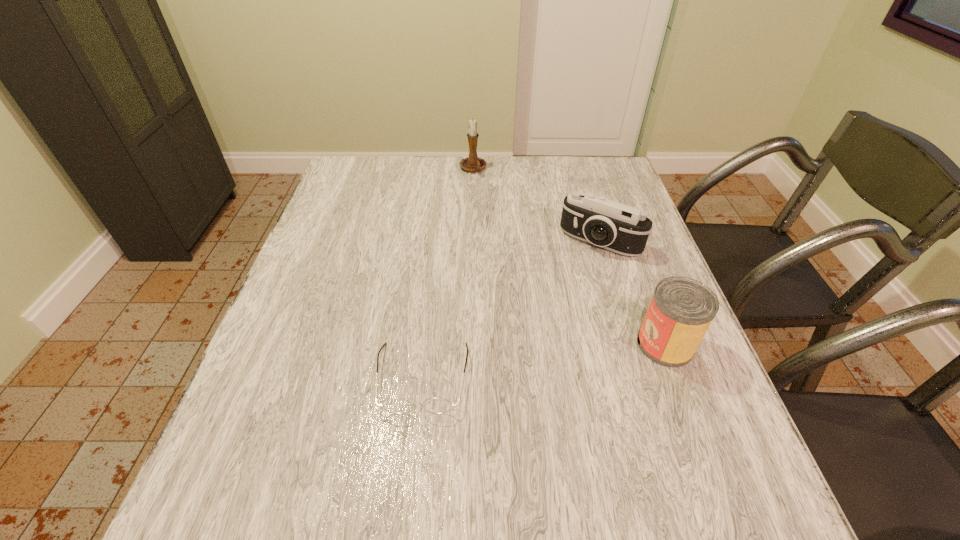
In order to click on free region at the far left corner of the desktop in this screenshot , I will do `click(354, 195)`.

Image resolution: width=960 pixels, height=540 pixels. I want to click on free location at the near right corner, so click(x=650, y=428).

In order to click on vacant point located between the spectacles and the farthest object in this screenshot , I will do `click(447, 273)`.

At what (x,y) coordinates should I click in order to perform the action: click on blank region between the shortest object and the candle holder. Please return your answer as a coordinate pair (x, y). The height and width of the screenshot is (540, 960). Looking at the image, I should click on (447, 273).

Image resolution: width=960 pixels, height=540 pixels. In order to click on free space between the spectacles and the camera in this screenshot , I will do `click(512, 309)`.

The image size is (960, 540). Find the location of `vacant region between the shortest object and the farthest object`. vacant region between the shortest object and the farthest object is located at coordinates (447, 273).

Where is `vacant area that lies between the farthest object and the can`? The image size is (960, 540). vacant area that lies between the farthest object and the can is located at coordinates (569, 256).

Image resolution: width=960 pixels, height=540 pixels. Identify the location of free space between the candle holder and the shortest object. (447, 273).

You are a GUI agent. You are given a task and a screenshot of the screen. Output one action in this format:
    pyautogui.click(x=<x>, y=<y>)
    Task: Click on the free space between the candle holder and the camera
    This screenshot has height=540, width=960.
    Given the screenshot: What is the action you would take?
    pyautogui.click(x=537, y=205)

I want to click on free space that is in between the farthest object and the second farthest object, so click(537, 205).